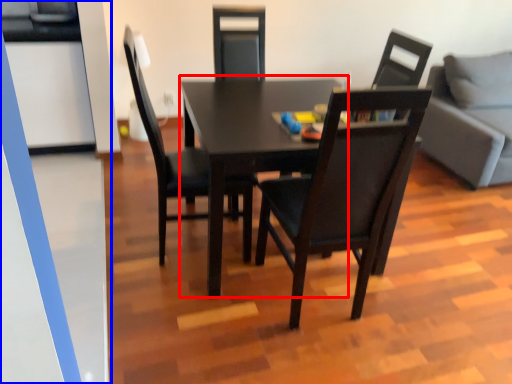
Question: Which object appears farthest to the camera in this image, table (highlighted by a red box) or glass door (highlighted by a blue box)?

Choices:
 (A) table
 (B) glass door

Answer: (A)